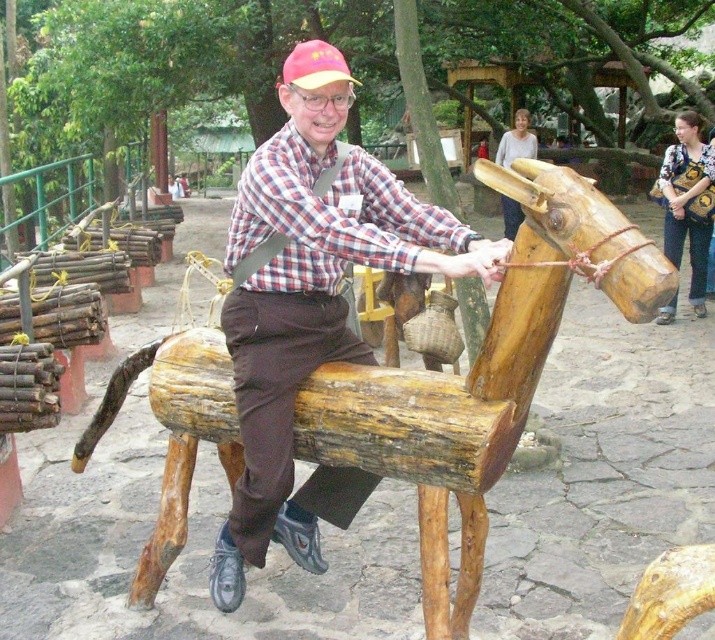
You are standing at point A, which is at coordinates point (315, 96). You want to walk to point B, which is at coordinates point (189, 346). According to the scene description, which direction should you move in to reach point B from point A?

To reach point B from point A, you should move towards the right and downward since point (189, 346) is behind point (315, 96), meaning it is located in the lower right direction relative to point A.

You are a park visitor standing in front of the natural wood horse at center and the wooden horse at center. Which one is located below the other?

The natural wood horse at center is positioned under the wooden horse at center, so the natural wood horse at center is below the wooden horse at center.

You are standing in the park and want to find the natural wood horse at center. According to the coordinates provided, where should you look relative to the center of the image?

The natural wood horse at center is located at coordinates approximately 0.588 on the x axis and 0.674 on the y axis, so you should look slightly to the right and down from the center of the image.